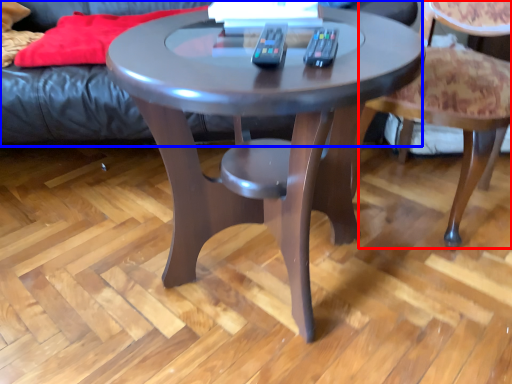
Question: Which object is further to the camera taking this photo, chair (highlighted by a red box) or couch (highlighted by a blue box)?

Choices:
 (A) chair
 (B) couch

Answer: (B)